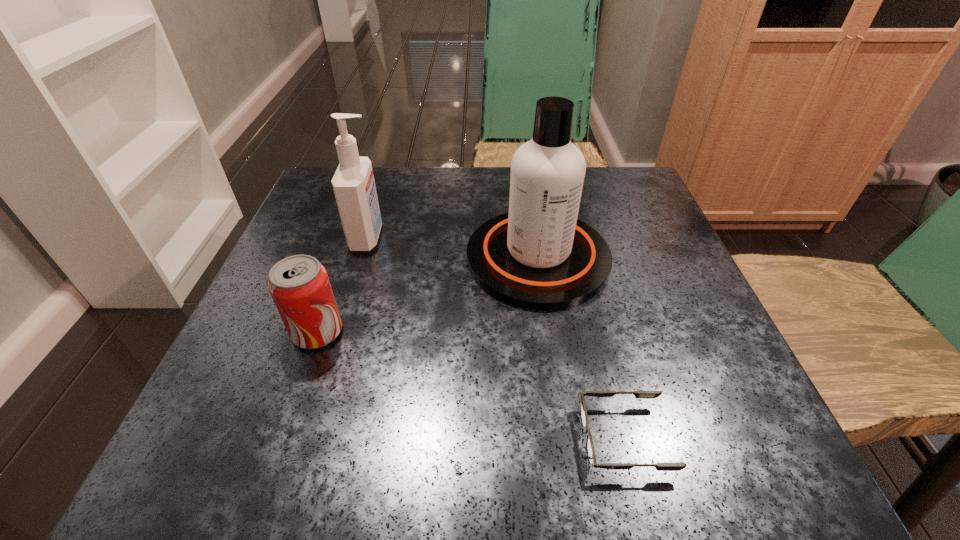
Where is `the right cleansing agent`? This screenshot has width=960, height=540. the right cleansing agent is located at coordinates (539, 256).

Image resolution: width=960 pixels, height=540 pixels. What are the coordinates of `the left cleansing agent` in the screenshot? It's located at (353, 183).

You are a GUI agent. You are given a task and a screenshot of the screen. Output one action in this format:
    pyautogui.click(x=<x>, y=<y>)
    Task: Click on the second tallest object
    
    Given the screenshot: What is the action you would take?
    (353, 183)

You are a GUI agent. You are given a task and a screenshot of the screen. Output one action in this format:
    pyautogui.click(x=<x>, y=<y>)
    Task: Click on the soda can
    
    Given the screenshot: What is the action you would take?
    pyautogui.click(x=299, y=285)

Find the location of a particular element. the second shortest object is located at coordinates (299, 285).

I want to click on sunglasses, so click(x=590, y=451).

This screenshot has width=960, height=540. Identify the location of the nearest object. [590, 451].

This screenshot has height=540, width=960. Find the location of `free space located on the front of the right cleansing agent`. free space located on the front of the right cleansing agent is located at coordinates pyautogui.click(x=553, y=359).

At what (x,y) coordinates should I click in order to perform the action: click on blank space located on the front label of the second tallest object. Please return your answer as a coordinate pair (x, y). The height and width of the screenshot is (540, 960). Looking at the image, I should click on tap(414, 238).

At what (x,y) coordinates should I click in order to perform the action: click on free region located 0.180m on the front of the third tallest object. Please return your answer as a coordinate pair (x, y). This screenshot has width=960, height=540. Looking at the image, I should click on (270, 468).